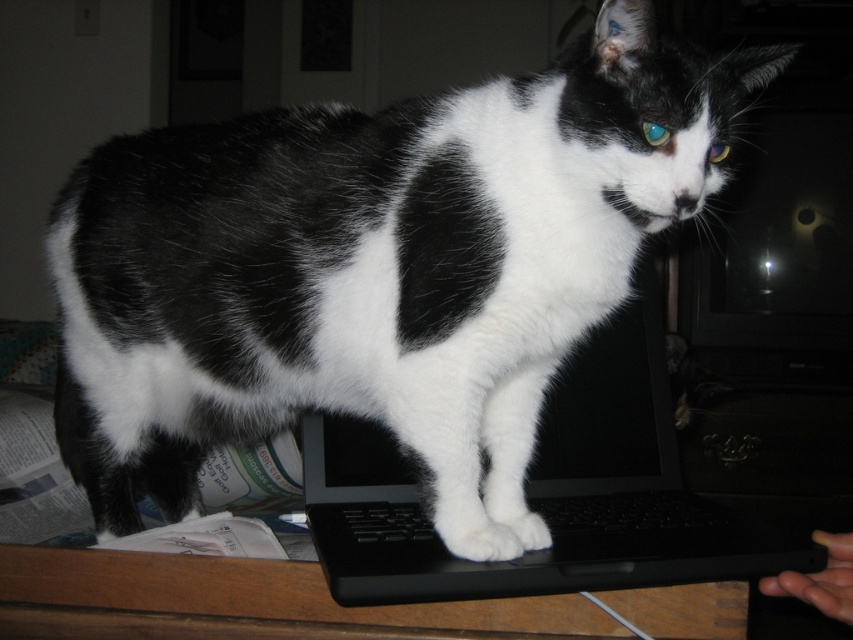
Question: Is black plastic laptop at center positioned before black matte keyboard at center?

Choices:
 (A) no
 (B) yes

Answer: (B)

Question: Among these objects, which one is nearest to the camera?

Choices:
 (A) black matte keyboard at center
 (B) black plastic laptop at center

Answer: (B)

Question: Does black plastic laptop at center appear on the left side of black matte keyboard at center?

Choices:
 (A) yes
 (B) no

Answer: (A)

Question: Does black plastic laptop at center appear on the left side of black matte keyboard at center?

Choices:
 (A) no
 (B) yes

Answer: (B)